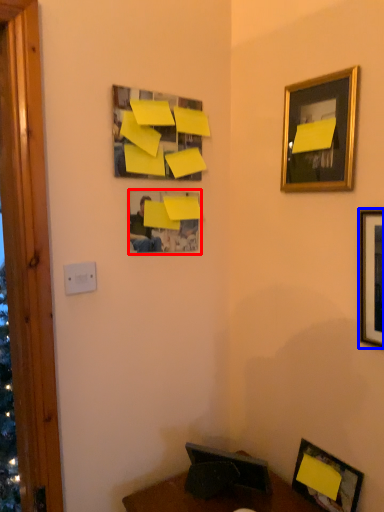
Question: Among these objects, which one is farthest to the camera, picture frame (highlighted by a red box) or picture frame (highlighted by a blue box)?

Choices:
 (A) picture frame
 (B) picture frame

Answer: (A)